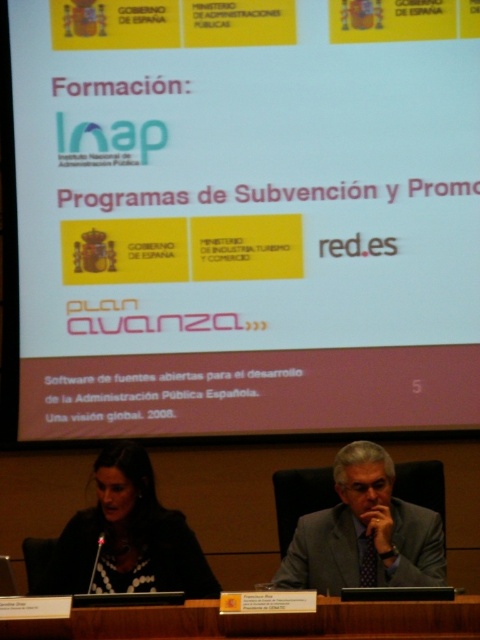
Question: Considering the real-world distances, which object is farthest from the brown wood table at lower center?

Choices:
 (A) gray suit at center
 (B) matte black dress at center

Answer: (B)

Question: Which of the following is the farthest from the observer?

Choices:
 (A) [398, 275]
 (B) [151, 628]
 (C) [176, 582]
 (D) [326, 544]

Answer: (A)

Question: Which point is farther to the camera?

Choices:
 (A) matte black dress at center
 (B) gray suit at center
 (C) brown wood table at lower center

Answer: (A)

Question: Is matte black dress at center wider than brown wood table at lower center?

Choices:
 (A) yes
 (B) no

Answer: (B)

Question: Can you confirm if white matte projection screen at upper center is positioned below brown wood table at lower center?

Choices:
 (A) yes
 (B) no

Answer: (B)

Question: Is white matte projection screen at upper center bigger than brown wood table at lower center?

Choices:
 (A) no
 (B) yes

Answer: (B)